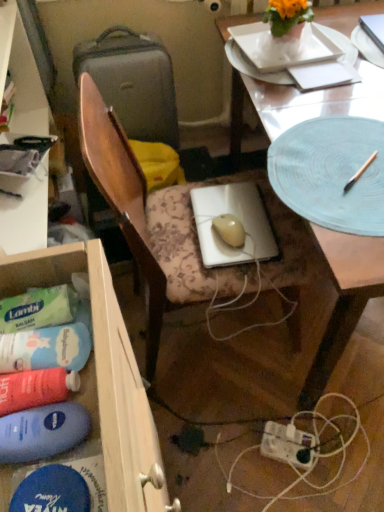
You are a GUI agent. You are given a task and a screenshot of the screen. Output one action in this format:
    pyautogui.click(x=<x>, y=<y>)
    Task: Click on the white paper at upper right
    The width and height of the screenshot is (384, 512).
    Given the screenshot: What is the action you would take?
    pyautogui.click(x=323, y=75)

The image size is (384, 512). What do you see at coordinates (343, 298) in the screenshot? I see `translucent glass desk at center` at bounding box center [343, 298].

Find the location of a particular element. The height and width of the screenshot is (512, 384). light blue textured platter at upper right is located at coordinates (331, 173).

Identify the location of blue matte paper plate at upper right. (367, 47).

Where is `white paper at upper right`? The height and width of the screenshot is (512, 384). white paper at upper right is located at coordinates (323, 75).

Is white paper at upper right not near translucent glass desk at center?

white paper at upper right is near translucent glass desk at center, not far away.

Between white paper at upper right and translucent glass desk at center, which one has larger size?

translucent glass desk at center.

Does white paper at upper right turn towards translucent glass desk at center?

Yes, white paper at upper right is facing translucent glass desk at center.

From the image's perspective, which one is positioned lower, white paper at upper right or translucent glass desk at center?

From the image's view, translucent glass desk at center is below.

Which object is more forward, light blue textured platter at upper right or wooden drawer at lower left?

wooden drawer at lower left.

This screenshot has width=384, height=512. In order to click on cabinetry in front of the light blue textured platter at upper right in this screenshot , I will do `click(104, 376)`.

Is light blue textured platter at upper right aimed at wooden drawer at lower left?

No, light blue textured platter at upper right is not facing towards wooden drawer at lower left.

In the image, is white paper at upper right positioned in front of or behind white plastic power plugs and sockets at lower center?

white paper at upper right is positioned closer to the viewer than white plastic power plugs and sockets at lower center.

Is white paper at upper right oriented towards white plastic power plugs and sockets at lower center?

No, white paper at upper right is not aimed at white plastic power plugs and sockets at lower center.

Considering the relative positions of white paper at upper right and white plastic power plugs and sockets at lower center in the image provided, is white paper at upper right to the left of white plastic power plugs and sockets at lower center from the viewer's perspective?

No, white paper at upper right is not to the left of white plastic power plugs and sockets at lower center.

In the image, is wooden drawer at lower left on the left side or the right side of light blue textured platter at upper right?

Clearly, wooden drawer at lower left is on the left of light blue textured platter at upper right in the image.

Is wooden drawer at lower left bigger than light blue textured platter at upper right?

Indeed, wooden drawer at lower left has a larger size compared to light blue textured platter at upper right.

Between wooden drawer at lower left and light blue textured platter at upper right, which one is positioned behind?

Positioned behind is light blue textured platter at upper right.

Based on the photo, which of these two, wooden chair at center or white plastic power plugs and sockets at lower center, is smaller?

Smaller between the two is white plastic power plugs and sockets at lower center.

How different are the orientations of wooden chair at center and white plastic power plugs and sockets at lower center in degrees?

The angular difference between wooden chair at center and white plastic power plugs and sockets at lower center is 119 degrees.

Locate an element on the screen. Image resolution: width=384 pixels, height=512 pixels. chair that is above the white plastic power plugs and sockets at lower center (from a real-world perspective) is located at coordinates (148, 221).

From the image's perspective, relative to white plastic power plugs and sockets at lower center, is wooden chair at center above or below?

From the image's perspective, wooden chair at center appears above white plastic power plugs and sockets at lower center.

Is blue matte paper plate at upper right oriented away from light blue textured platter at upper right?

No, blue matte paper plate at upper right's orientation is not away from light blue textured platter at upper right.

Considering the positions of objects blue matte paper plate at upper right and light blue textured platter at upper right in the image provided, who is more to the left, blue matte paper plate at upper right or light blue textured platter at upper right?

Positioned to the left is light blue textured platter at upper right.

Is blue matte paper plate at upper right thinner than light blue textured platter at upper right?

Correct, the width of blue matte paper plate at upper right is less than that of light blue textured platter at upper right.

From a real-world perspective, is white plastic power plugs and sockets at lower center physically located above or below wooden chair at center?

In terms of real-world spatial position, white plastic power plugs and sockets at lower center is below wooden chair at center.

Is white plastic power plugs and sockets at lower center situated inside wooden chair at center or outside?

white plastic power plugs and sockets at lower center is located beyond the bounds of wooden chair at center.

How different are the orientations of white plastic power plugs and sockets at lower center and wooden chair at center in degrees?

The facing directions of white plastic power plugs and sockets at lower center and wooden chair at center are 119 degrees apart.

Is white plastic power plugs and sockets at lower center wider or thinner than wooden chair at center?

Considering their sizes, white plastic power plugs and sockets at lower center looks slimmer than wooden chair at center.

The height and width of the screenshot is (512, 384). Identify the location of desk below the white paper at upper right (from the image's perspective). (343, 298).

Where is `platter on the right of wooden drawer at lower left`? The width and height of the screenshot is (384, 512). platter on the right of wooden drawer at lower left is located at coordinates (331, 173).

Based on their spatial positions, is light blue textured platter at upper right or wooden chair at center further from white paper at upper right?

wooden chair at center lies further to white paper at upper right than the other object.

Based on their spatial positions, is wooden drawer at lower left or matte gray suitcase at left closer to white plastic power plugs and sockets at lower center?

wooden drawer at lower left is positioned closer to the anchor white plastic power plugs and sockets at lower center.

Based on their spatial positions, is white plastic power plugs and sockets at lower center or wooden chair at center further from translucent glass desk at center?

white plastic power plugs and sockets at lower center lies further to translucent glass desk at center than the other object.

Consider the image. Based on their spatial positions, is matte gray suitcase at left or wooden chair at center closer to translucent glass desk at center?

matte gray suitcase at left is positioned closer to the anchor translucent glass desk at center.

Based on their spatial positions, is wooden drawer at lower left or translucent glass desk at center further from matte gray suitcase at left?

wooden drawer at lower left.

In the scene shown: Which object lies further to the anchor point light blue textured platter at upper right, wooden chair at center or translucent glass desk at center?

Based on the image, wooden chair at center appears to be further to light blue textured platter at upper right.

Looking at the image, which one is located further to light blue textured platter at upper right, white plastic power plugs and sockets at lower center or matte gray suitcase at left?

matte gray suitcase at left lies further to light blue textured platter at upper right than the other object.

When comparing their distances from wooden chair at center, does translucent glass desk at center or wooden drawer at lower left seem closer?

Based on the image, translucent glass desk at center appears to be nearer to wooden chair at center.

I want to click on chair between blue matte paper plate at upper right and white plastic power plugs and sockets at lower center in the vertical direction, so click(148, 221).

Locate an element on the screen. suitcase between blue matte paper plate at upper right and wooden drawer at lower left in the up-down direction is located at coordinates (133, 82).

Identify the location of platter between matte gray suitcase at left and blue matte paper plate at upper right. (331, 173).

Find the location of `platter between blue matte paper plate at upper right and wooden drawer at lower left from top to bottom`. platter between blue matte paper plate at upper right and wooden drawer at lower left from top to bottom is located at coordinates (331, 173).